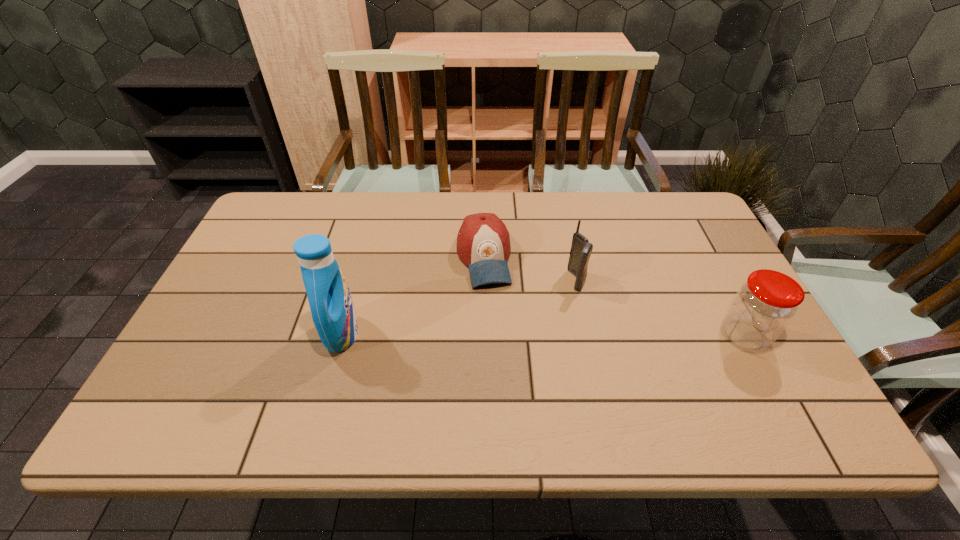
Locate an element on the screen. The height and width of the screenshot is (540, 960). free space on the desktop that is between the detergent and the rightmost object and is positioned on the front-facing side of the shortest object is located at coordinates (501, 334).

This screenshot has width=960, height=540. I want to click on vacant space on the desktop that is between the leftmost object and the jar and is positioned on the keyboard of the second object from right to left, so click(483, 334).